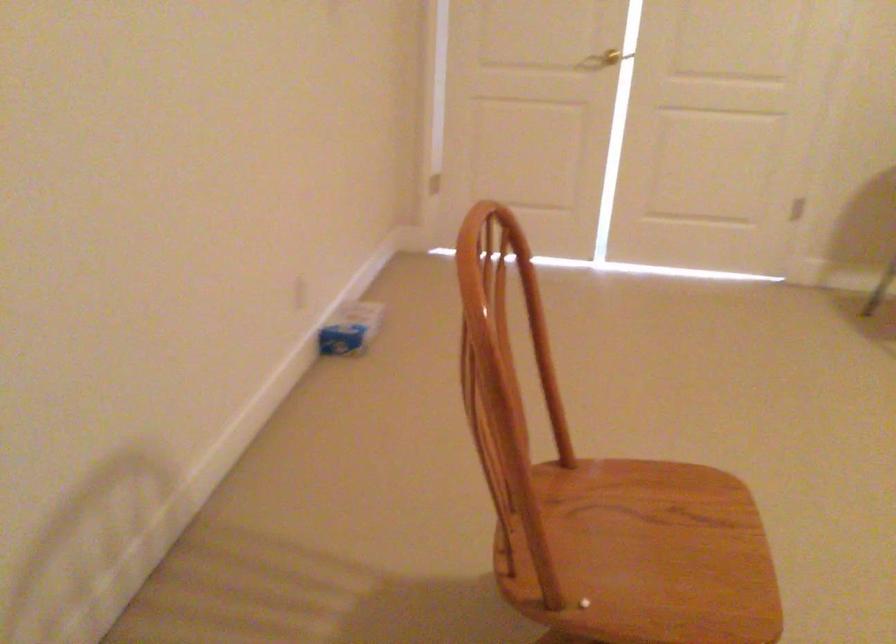
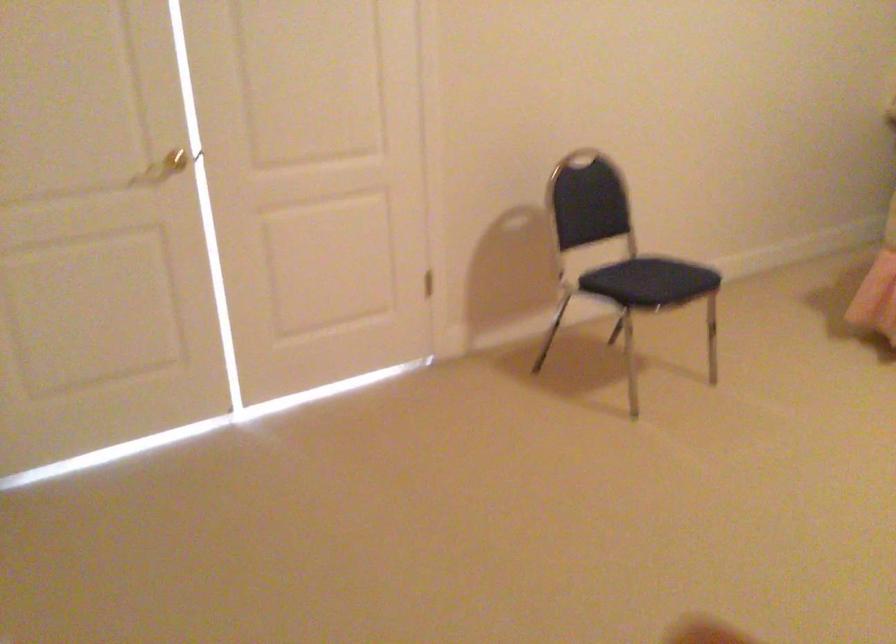
Question: Based on the continuous images, in which direction is the camera rotating? Reply with the corresponding letter.

Choices:
 (A) Left
 (B) Right
 (C) Up
 (D) Down

Answer: (B)